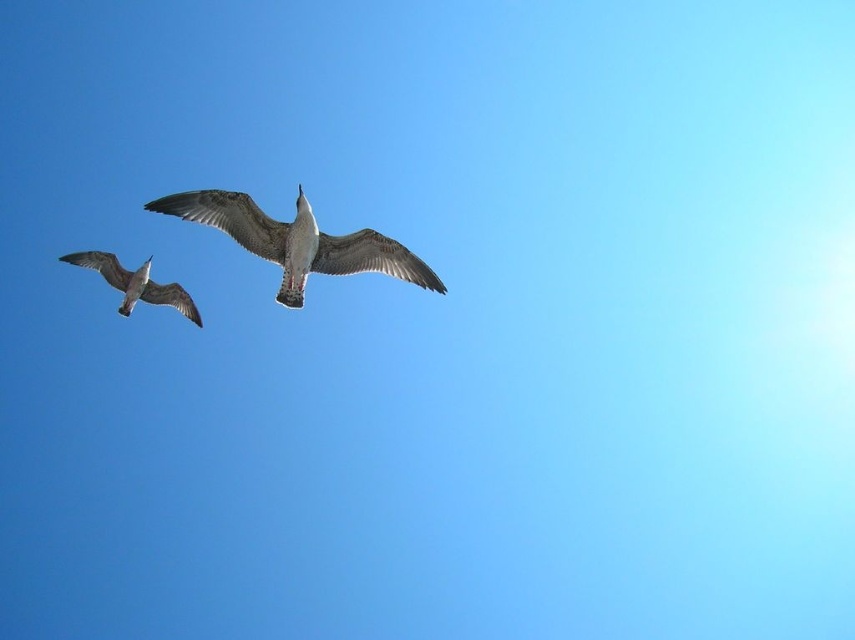
Question: Considering the relative positions of white feathered bird at center and white feathered bird at left in the image provided, where is white feathered bird at center located with respect to white feathered bird at left?

Choices:
 (A) above
 (B) below

Answer: (A)

Question: Where is white feathered bird at center located in relation to white feathered bird at left in the image?

Choices:
 (A) above
 (B) below

Answer: (A)

Question: Does white feathered bird at center have a larger size compared to white feathered bird at left?

Choices:
 (A) yes
 (B) no

Answer: (A)

Question: Which of the following is the farthest from the observer?

Choices:
 (A) white feathered bird at center
 (B) white feathered bird at left

Answer: (B)

Question: Which of the following is the closest to the observer?

Choices:
 (A) (243, 236)
 (B) (104, 269)

Answer: (A)